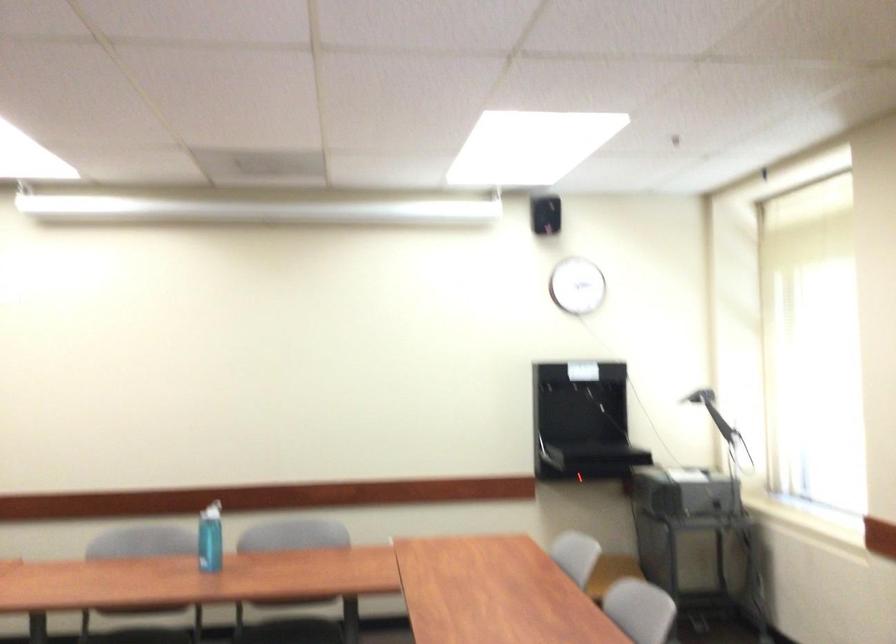
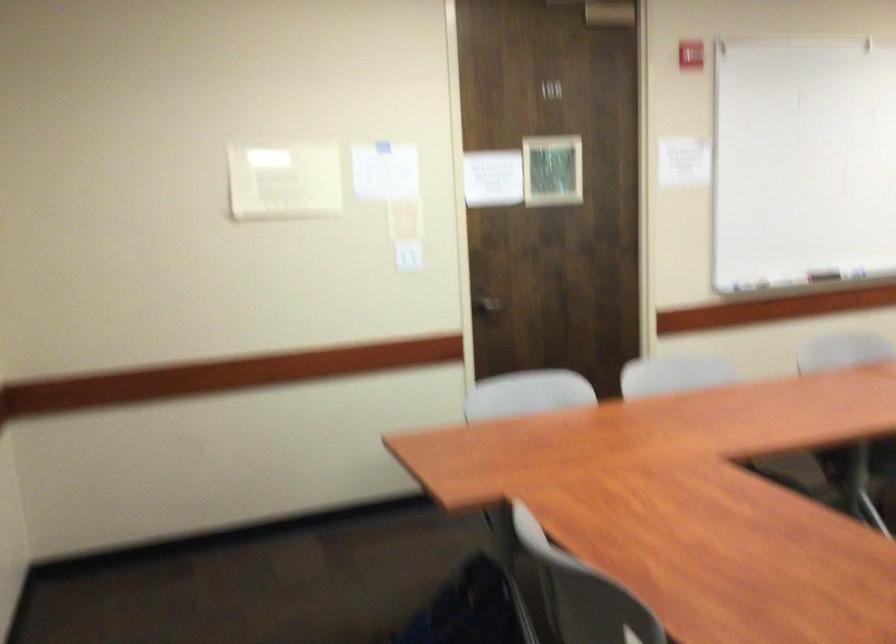
Question: The camera is either moving clockwise (left) or counter-clockwise (right) around the object. The first image is from the beginning of the video and the second image is from the end. Is the camera moving left or right when shooting the video?

Choices:
 (A) Left
 (B) Right

Answer: (B)